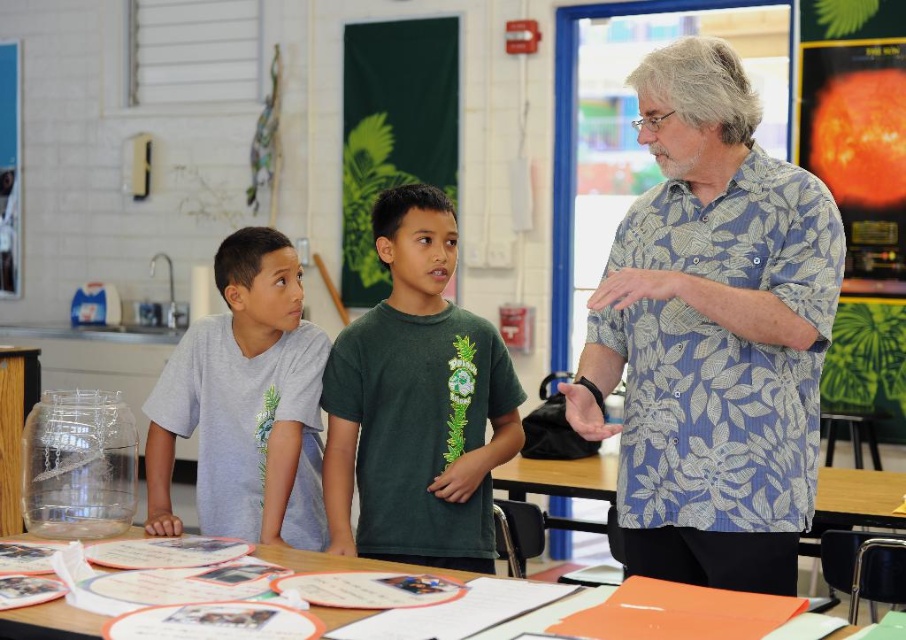
You are a student in the classroom and need to hand in a paper. You are standing near the gray matte shirt at center. Can you reach the orange paper at lower center without moving closer to it?

The gray matte shirt at center is further to the viewer than orange paper at lower center, so the orange paper at lower center is behind the shirt. Therefore, you cannot reach the orange paper at lower center without moving closer to it.